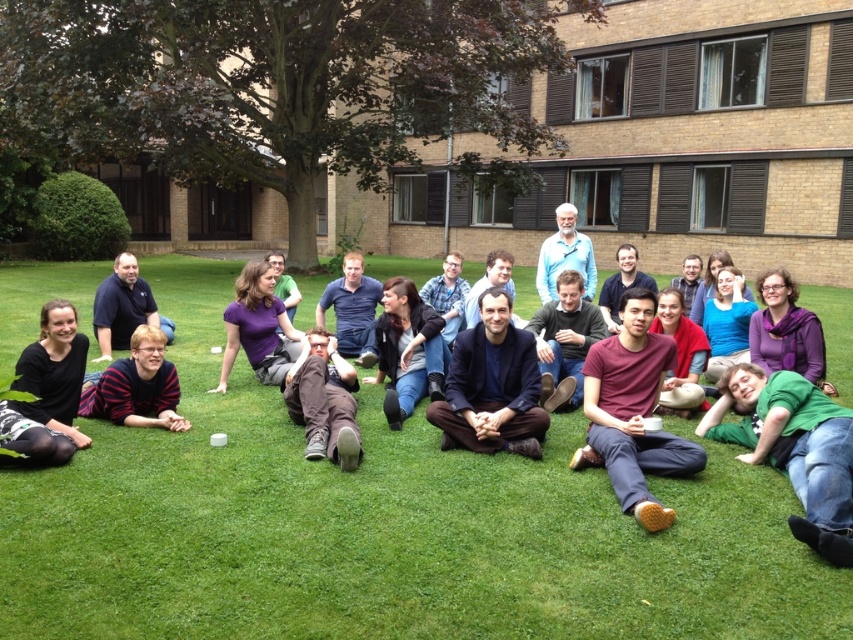
Which is more to the right, green grass at center or green cotton shirt at lower right?

green cotton shirt at lower right

Who is more distant from viewer, (432, 627) or (782, 422)?

The point (782, 422) is behind.

Is point (3, 499) closer to camera compared to point (816, 518)?

That is False.

Locate an element on the screen. This screenshot has height=640, width=853. green grass at center is located at coordinates (381, 529).

In the scene shown: Can you confirm if dark blue fabric at center is thinner than dark blue shirt at center?

Incorrect, dark blue fabric at center's width is not less than dark blue shirt at center's.

Is dark blue fabric at center smaller than dark blue shirt at center?

Correct, dark blue fabric at center occupies less space than dark blue shirt at center.

Does point (473, 436) come behind point (113, 337)?

No, (473, 436) is closer to viewer.

The image size is (853, 640). I want to click on dark blue fabric at center, so click(491, 387).

Who is lower down, maroon cotton shirt at center or dark blue fabric at center?

Positioned lower is maroon cotton shirt at center.

Identify the location of maroon cotton shirt at center. (631, 412).

Does point (589, 403) come behind point (515, 352)?

No, (589, 403) is closer to viewer.

I want to click on maroon cotton shirt at center, so click(x=631, y=412).